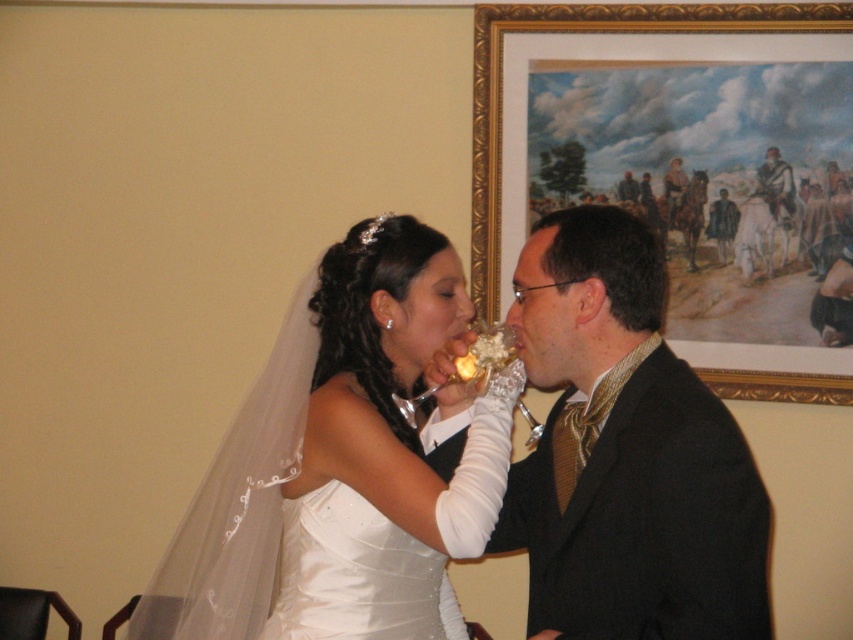
You are a photographer at a wedding and need to capture a closeup shot of both the shiny gold tie at center and the white satin dress at center. The camera you are using has a maximum focus range of 8 inches. Can you fit both objects in the frame without moving the camera?

The shiny gold tie at center and white satin dress at center are 8.68 inches apart from each other. Since the distance between them exceeds the camera maximum focus range of 8 inches, you cannot fit both objects in the frame without moving the camera.